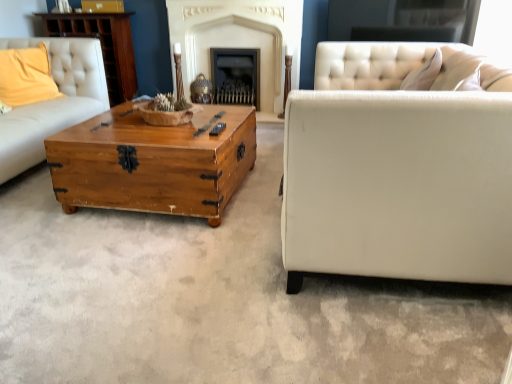
Question: Considering the positions of point (169, 155) and point (81, 18), is point (169, 155) closer or farther from the camera than point (81, 18)?

Choices:
 (A) farther
 (B) closer

Answer: (B)

Question: From the image's perspective, relative to wooden dresser at upper left, is wooden trunk at center above or below?

Choices:
 (A) above
 (B) below

Answer: (B)

Question: Which of these objects is positioned farthest from the smooth stone fireplace at center, the 1th fireplace from the left?

Choices:
 (A) yellow fabric pillow at upper left
 (B) wooden trunk at center
 (C) black matte fireplace at center, the 2th fireplace positioned from the left
 (D) wooden dresser at upper left

Answer: (B)

Question: Estimate the real-world distances between objects in this image. Which object is closer to the black matte fireplace at center, the 2th fireplace positioned from the left?

Choices:
 (A) wooden trunk at center
 (B) smooth stone fireplace at center, the 1th fireplace from the left
 (C) yellow fabric pillow at upper left
 (D) wooden dresser at upper left

Answer: (B)